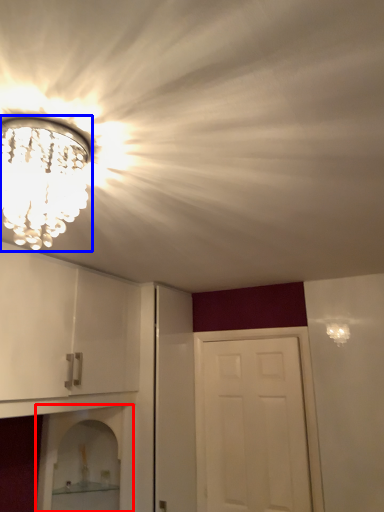
Question: Which object appears closest to the camera in this image, shelf (highlighted by a red box) or light fixture (highlighted by a blue box)?

Choices:
 (A) shelf
 (B) light fixture

Answer: (B)